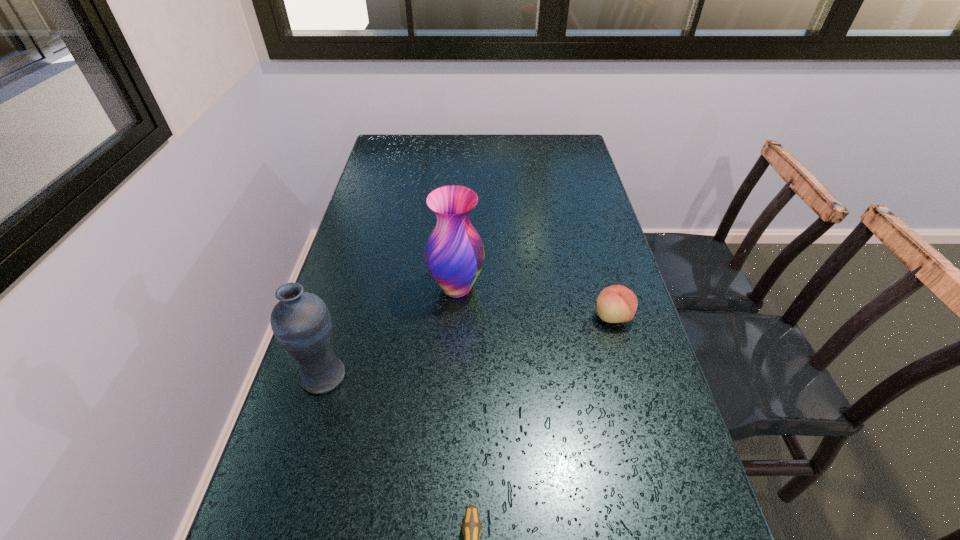
In the image, there is a desktop. Where is `free space at the far edge`? free space at the far edge is located at coordinates (431, 155).

In the image, there is a desktop. In order to click on vacant space at the left edge in this screenshot , I will do `click(373, 230)`.

Where is `vacant area at the right edge of the desktop`? The height and width of the screenshot is (540, 960). vacant area at the right edge of the desktop is located at coordinates (561, 249).

This screenshot has width=960, height=540. In the image, there is a desktop. Find the location of `vacant space at the far left corner`. vacant space at the far left corner is located at coordinates (391, 145).

You are a GUI agent. You are given a task and a screenshot of the screen. Output one action in this format:
    pyautogui.click(x=<x>, y=<y>)
    Task: Click on the vacant space that's between the nearer vase and the right vase
    
    Given the screenshot: What is the action you would take?
    pyautogui.click(x=391, y=332)

Find the location of `free space between the farther vase and the left vase`. free space between the farther vase and the left vase is located at coordinates (391, 332).

Find the location of a particular element. This screenshot has width=960, height=540. empty space that is in between the nearer vase and the farther vase is located at coordinates (391, 332).

At what (x,y) coordinates should I click in order to perform the action: click on free space between the right vase and the peach. Please return your answer as a coordinate pair (x, y). This screenshot has width=960, height=540. Looking at the image, I should click on (535, 302).

Identify the location of free space between the right vase and the nearer vase. Image resolution: width=960 pixels, height=540 pixels. (391, 332).

Identify the location of free space between the rightmost object and the farther vase. (535, 302).